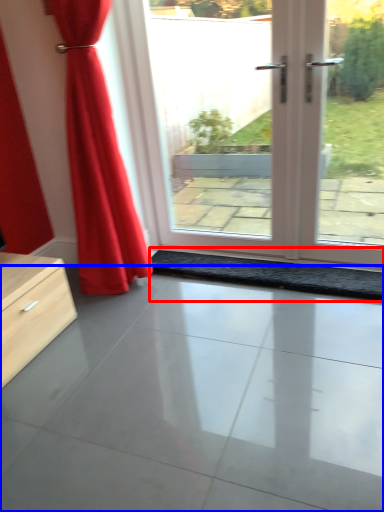
Question: Among these objects, which one is farthest to the camera, doormat (highlighted by a red box) or concrete (highlighted by a blue box)?

Choices:
 (A) doormat
 (B) concrete

Answer: (A)